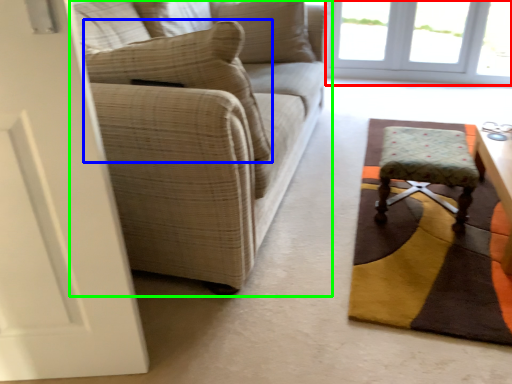
Question: Which object is positioned closest to window (highlighted by a red box)? Select from pillow (highlighted by a blue box) and studio couch (highlighted by a green box).

Choices:
 (A) pillow
 (B) studio couch

Answer: (B)